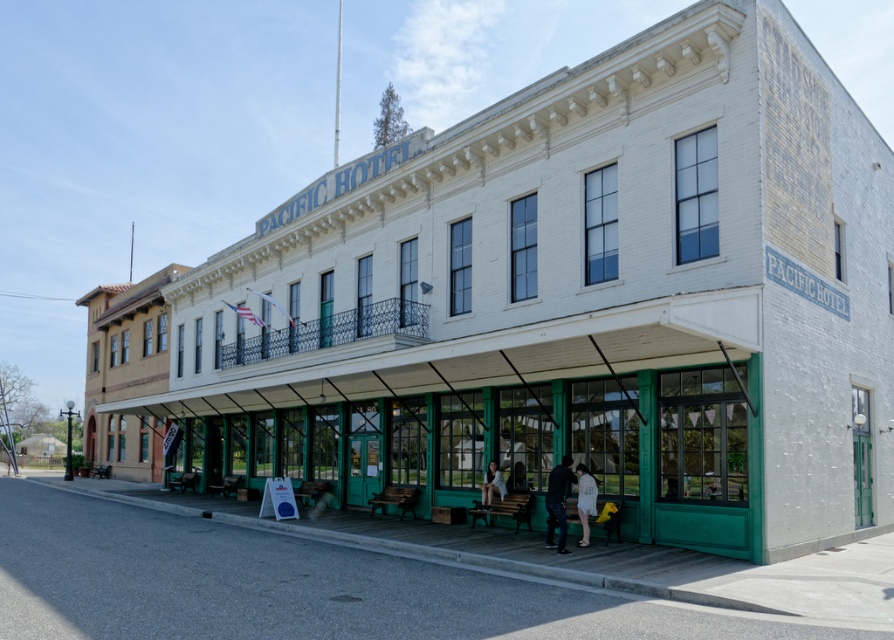
Between white cotton dress at lower center and light brown wooden bench at lower center, which one appears on the right side from the viewer's perspective?

white cotton dress at lower center is more to the right.

Which is behind, point (579, 512) or point (505, 486)?

The point (505, 486) is behind.

Locate an element on the screen. Image resolution: width=894 pixels, height=640 pixels. white cotton dress at lower center is located at coordinates (585, 500).

Can you confirm if dark blue jeans at lower center is smaller than light brown wooden bench at lower center?

Incorrect, dark blue jeans at lower center is not smaller in size than light brown wooden bench at lower center.

What do you see at coordinates (558, 502) in the screenshot? The height and width of the screenshot is (640, 894). I see `dark blue jeans at lower center` at bounding box center [558, 502].

What do you see at coordinates (558, 502) in the screenshot? This screenshot has width=894, height=640. I see `dark blue jeans at lower center` at bounding box center [558, 502].

Where is `dark blue jeans at lower center`? This screenshot has width=894, height=640. dark blue jeans at lower center is located at coordinates (558, 502).

Who is taller, dark blue jeans at lower center or white cotton dress at lower center?

dark blue jeans at lower center

Is dark blue jeans at lower center to the left of white cotton dress at lower center from the viewer's perspective?

Indeed, dark blue jeans at lower center is positioned on the left side of white cotton dress at lower center.

Where is `dark blue jeans at lower center`? dark blue jeans at lower center is located at coordinates pyautogui.click(x=558, y=502).